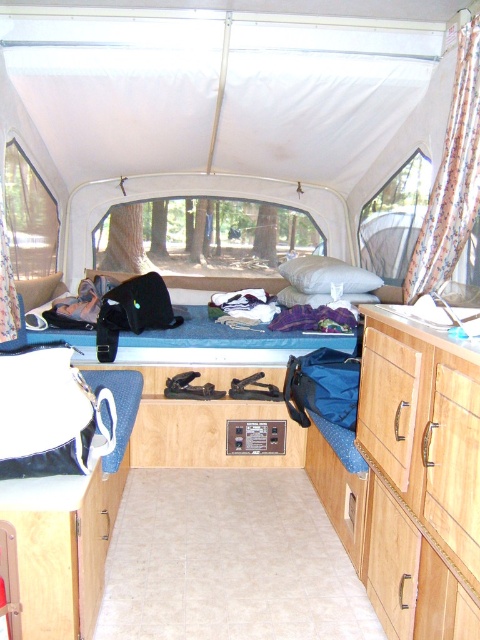
Between blue fabric bed at center and floral fabric curtain at left, which one is positioned higher?

floral fabric curtain at left is above.

Is point (88, 332) farther from camera compared to point (1, 193)?

That is True.

This screenshot has height=640, width=480. Identify the location of blue fabric bed at center. (229, 333).

Who is lower down, wooden drawer at center-right or floral fabric curtain at left?

wooden drawer at center-right is below.

Is wooden drawer at center-right above floral fabric curtain at left?

Actually, wooden drawer at center-right is below floral fabric curtain at left.

Does point (402, 461) come in front of point (0, 234)?

Yes, point (402, 461) is in front of point (0, 234).

Where is `wooden drawer at center-right`? This screenshot has width=480, height=640. wooden drawer at center-right is located at coordinates click(x=420, y=476).

Does wooden drawer at center-right have a lesser height compared to floral fabric curtain at right?

Correct, wooden drawer at center-right is not as tall as floral fabric curtain at right.

Is point (397, 448) in front of point (459, 61)?

Yes, it is.

The width and height of the screenshot is (480, 640). What are the coordinates of `wooden drawer at center-right` in the screenshot? It's located at (420, 476).